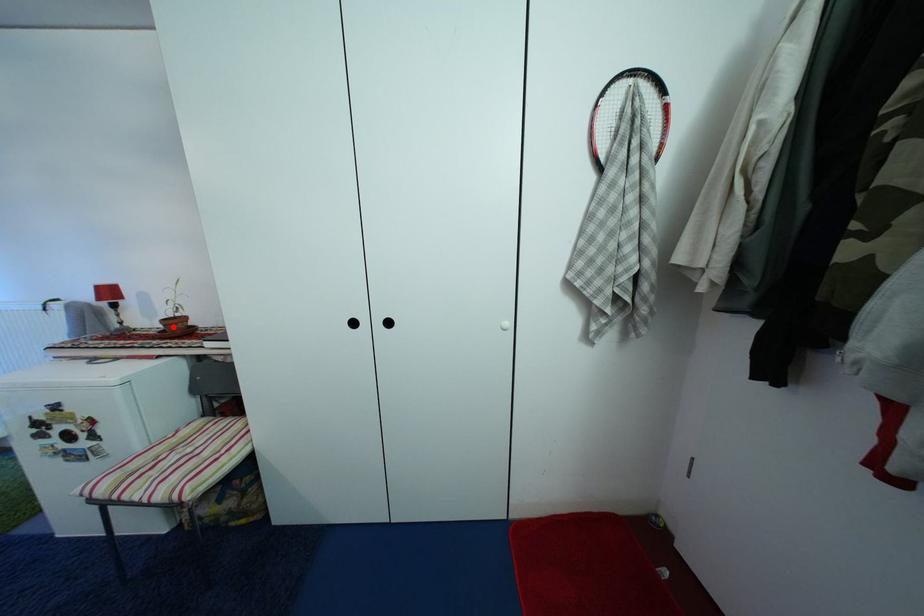
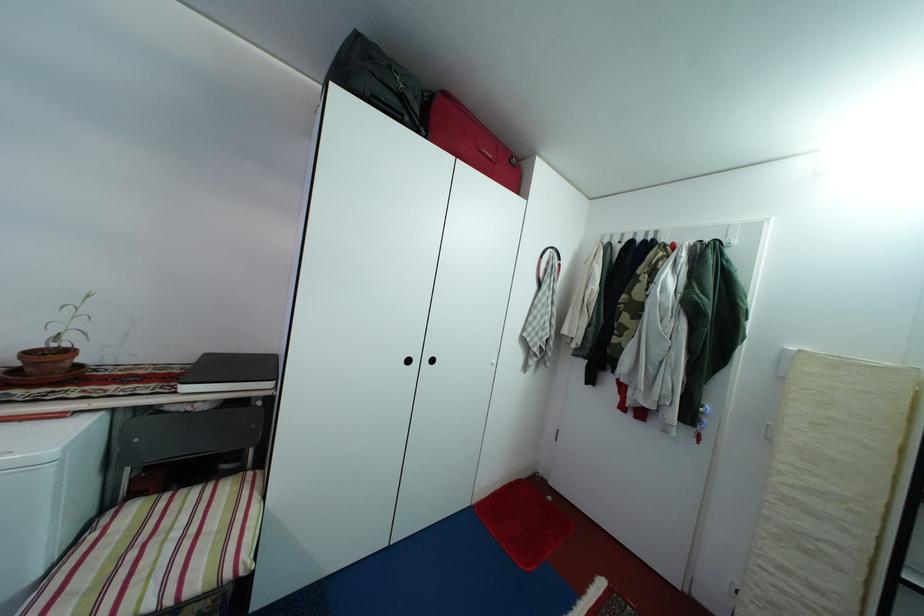
Find the pixel in the second image that matches the highlighted location in the first image.

(38, 361)